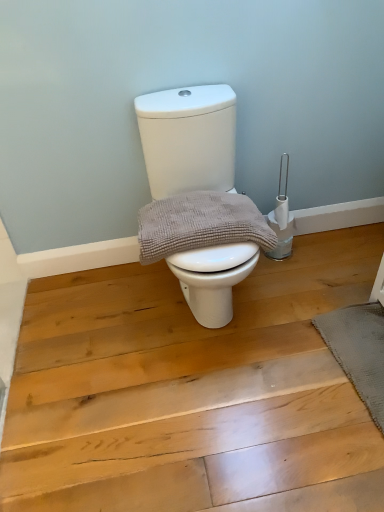
At what (x,y) coordinates should I click in order to perform the action: click on empty space that is ontop of gray textured towel at center (from a real-world perspective). Please return your answer as a coordinate pair (x, y). Looking at the image, I should click on (202, 217).